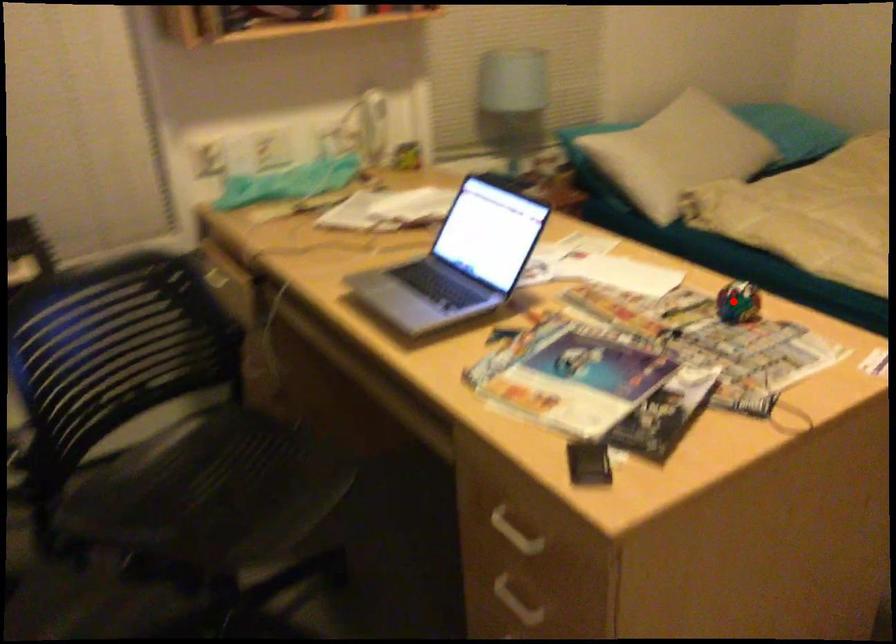
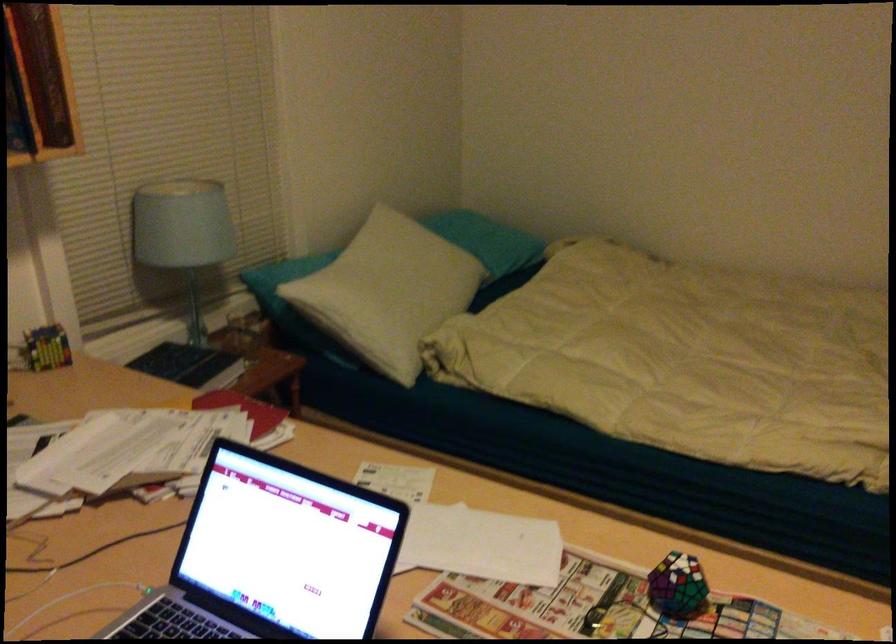
Find the pixel in the second image that matches the highlighted location in the first image.

(677, 585)